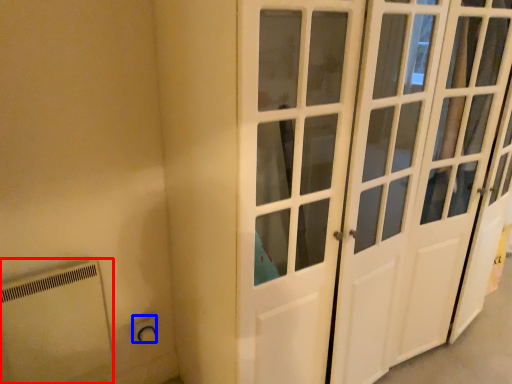
Question: Which object appears farthest to the camera in this image, appliance (highlighted by a red box) or electric outlet (highlighted by a blue box)?

Choices:
 (A) appliance
 (B) electric outlet

Answer: (B)